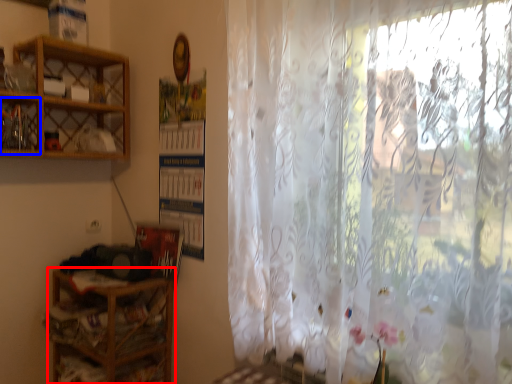
Question: Among these objects, which one is farthest to the camera, shelf (highlighted by a red box) or cabinet (highlighted by a blue box)?

Choices:
 (A) shelf
 (B) cabinet

Answer: (A)